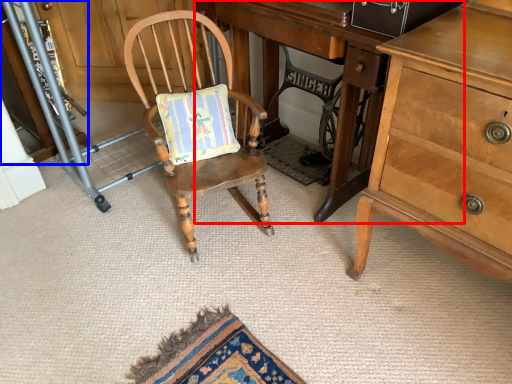
Question: Which point is closer to the camera, desk (highlighted by a red box) or cabinetry (highlighted by a blue box)?

Choices:
 (A) desk
 (B) cabinetry

Answer: (A)